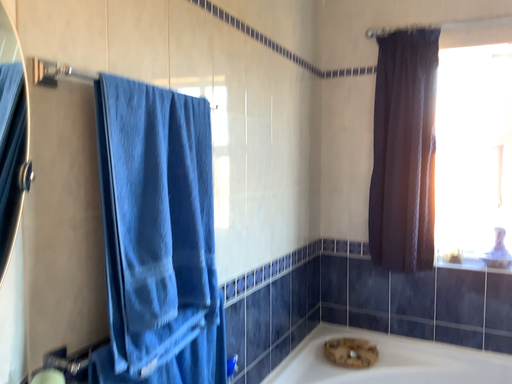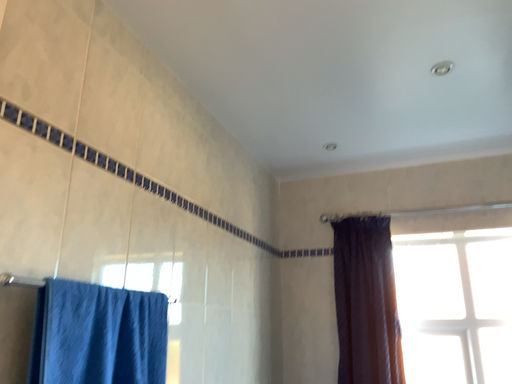
Question: How did the camera likely rotate when shooting the video?

Choices:
 (A) rotated upward
 (B) rotated downward

Answer: (A)